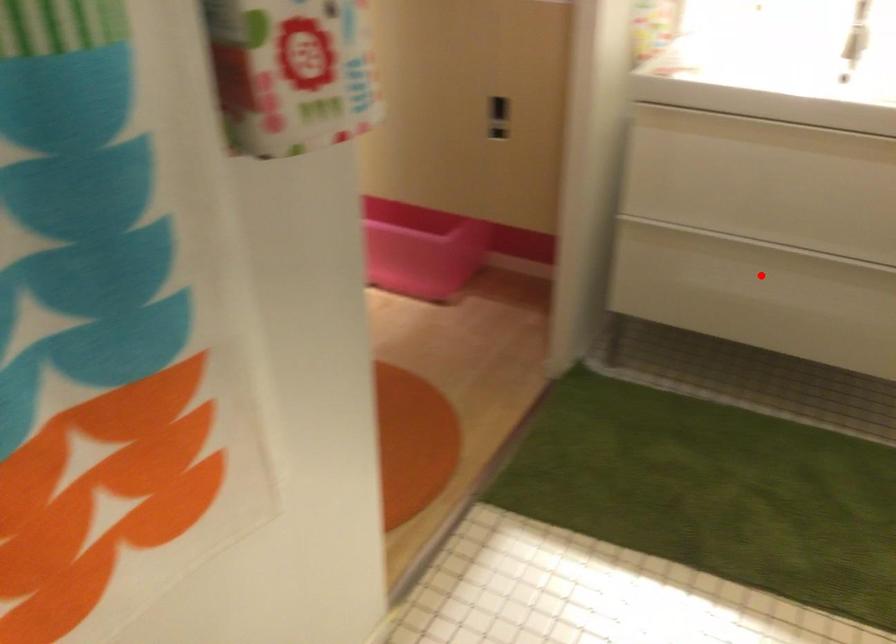
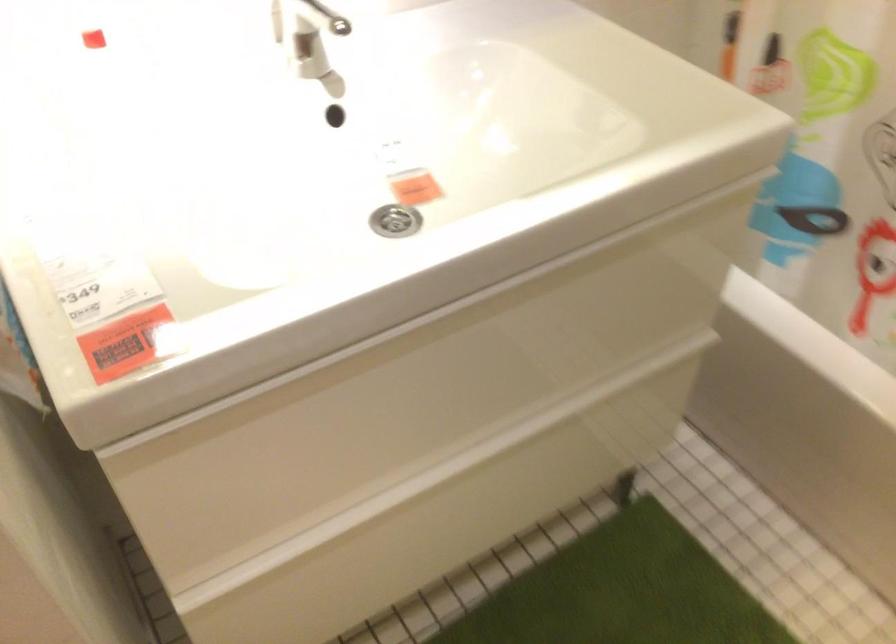
Question: I am providing you with two images of the same scene from different viewpoints. A red point is marked on the first image. Can you still see the location of the red point in image 2?

Choices:
 (A) Yes
 (B) No

Answer: (A)